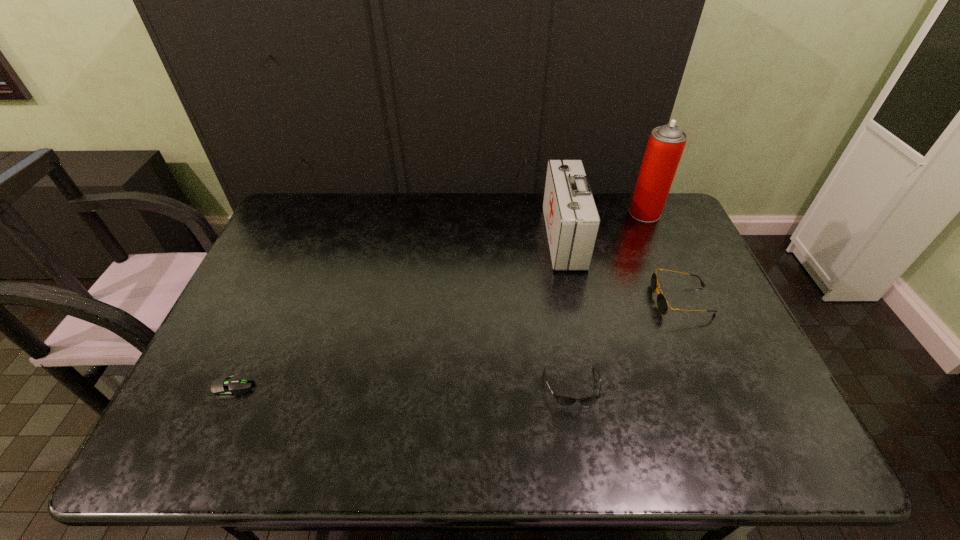
The width and height of the screenshot is (960, 540). What are the coordinates of `vacant region that satisfies the following two spatial constraints: 1. on the back side of the leftmost object; 2. on the left side of the tallest object` in the screenshot? It's located at (311, 213).